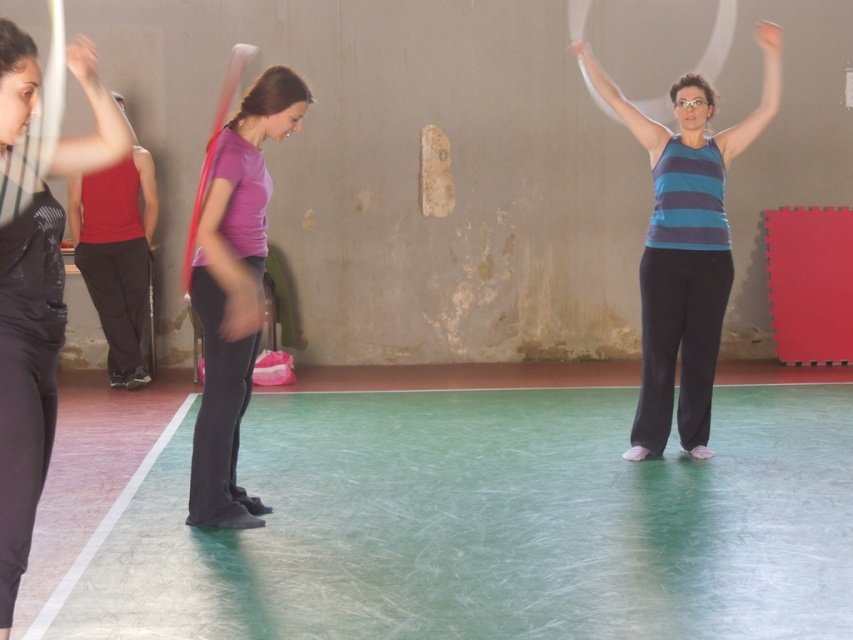
You are standing at the origin point of the gymnasium coordinate system. The gymnasium floor has a grid marked with coordinates. You need to place a small red dot sticker exactly where the purple matte shirt at center is located. What are the coordinates where you should place the sticker?

The coordinates to place the sticker for the purple matte shirt at center are at point (234, 291).

Based on the photo, you are standing at the entrance of the gymnasium and want to locate the striped tank top at center. According to the coordinates provided, where should you look relative to the image frame?

The striped tank top at center is located at the 2D coordinates point (685, 246), which means it is positioned approximately 38.6 percent from the left edge and 80.4 percent from the top edge of the image frame.